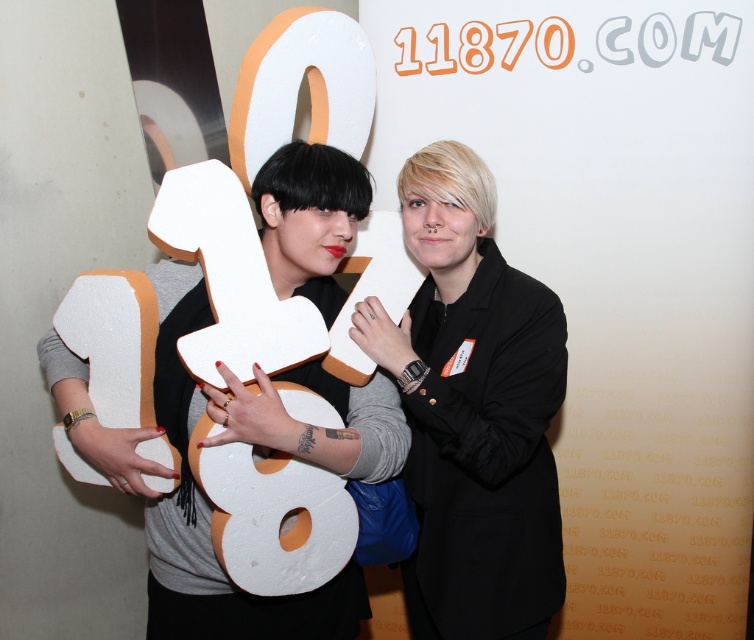
Where is `black matte jacket at center`? black matte jacket at center is located at coordinates (474, 410).

At what (x,y) coordinates should I click in order to perform the action: click on black matte jacket at center. Please return your answer as a coordinate pair (x, y). Looking at the image, I should click on (474, 410).